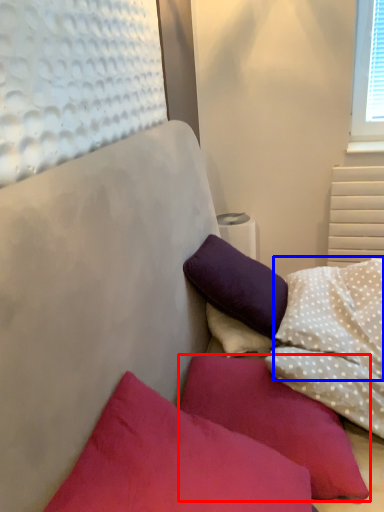
Question: Among these objects, which one is nearest to the camera, pillow (highlighted by a red box) or pillow (highlighted by a blue box)?

Choices:
 (A) pillow
 (B) pillow

Answer: (A)